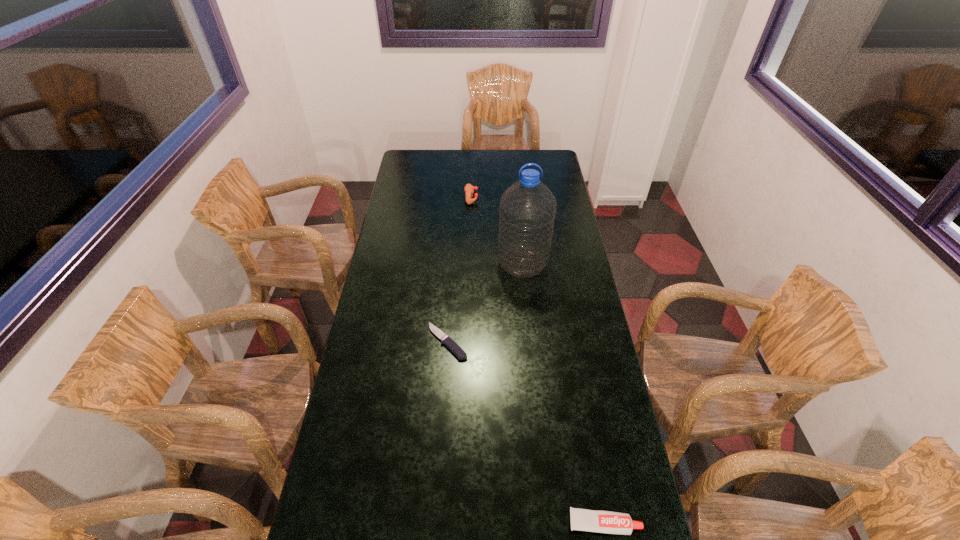
You are a GUI agent. You are given a task and a screenshot of the screen. Output one action in this format:
    pyautogui.click(x=<x>, y=<y>)
    Task: Click on the vacant space that satisfies the following two spatial constraints: 1. with the gloves of the farthest object facing forward; 2. on the right side of the tallest object
    The width and height of the screenshot is (960, 540).
    Given the screenshot: What is the action you would take?
    pyautogui.click(x=469, y=264)

The width and height of the screenshot is (960, 540). What are the coordinates of `vacant area that satisfies the following two spatial constraints: 1. on the front side of the toothpaste; 2. on the right side of the water jug` in the screenshot? It's located at (548, 523).

Locate an element on the screen. vacant area in the image that satisfies the following two spatial constraints: 1. on the front side of the third farthest object; 2. on the left side of the second shortest object is located at coordinates (436, 523).

Find the location of `vacant region that satisfies the following two spatial constraints: 1. with the gloves of the farthest object facing forward; 2. on the right side of the toothpaste`. vacant region that satisfies the following two spatial constraints: 1. with the gloves of the farthest object facing forward; 2. on the right side of the toothpaste is located at coordinates (464, 523).